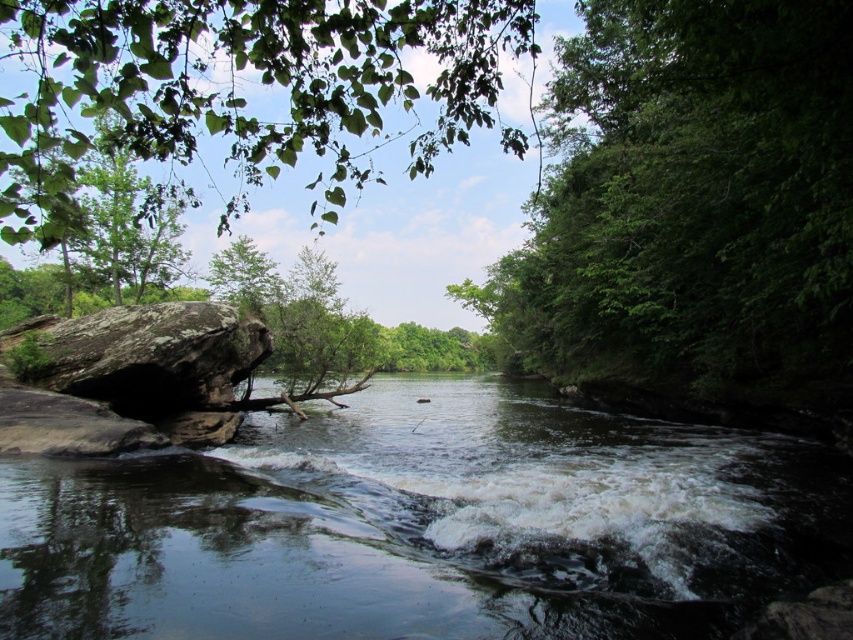
Question: Does smooth dark water at center have a lesser width compared to rough textured rock at left?

Choices:
 (A) no
 (B) yes

Answer: (A)

Question: Which of the following is the closest to the observer?

Choices:
 (A) (485, 128)
 (B) (351, 541)

Answer: (B)

Question: Can you confirm if smooth dark water at center is wider than green leafy tree at upper left?

Choices:
 (A) yes
 (B) no

Answer: (B)

Question: Is smooth dark water at center to the left of green leafy tree at upper left from the viewer's perspective?

Choices:
 (A) no
 (B) yes

Answer: (A)

Question: Which of the following is the closest to the observer?

Choices:
 (A) (177, 307)
 (B) (33, 113)

Answer: (B)

Question: Which point is farther to the camera?

Choices:
 (A) (33, 372)
 (B) (520, 529)
 (C) (308, 10)
 (D) (567, 200)

Answer: (D)